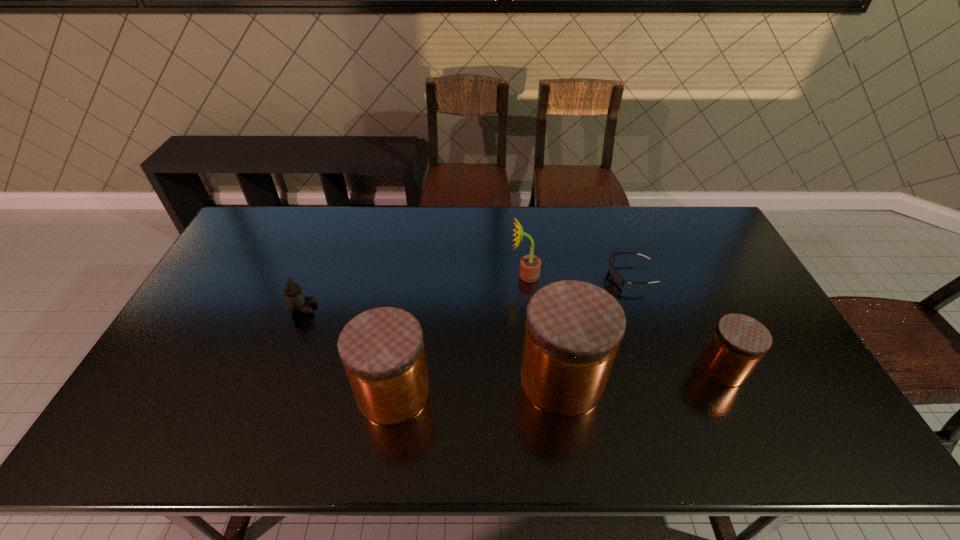
I want to click on object that is positioned at the right edge, so click(x=738, y=342).

The image size is (960, 540). Find the location of `object located in the near right corner section of the desktop`. object located in the near right corner section of the desktop is located at coordinates (738, 342).

Find the location of `vacant area at the far edge of the desktop`. vacant area at the far edge of the desktop is located at coordinates (482, 209).

Where is `vacant space at the left edge of the desktop`? This screenshot has height=540, width=960. vacant space at the left edge of the desktop is located at coordinates (186, 355).

The image size is (960, 540). I want to click on free space at the right edge of the desktop, so click(702, 249).

Find the location of a particular element. The width and height of the screenshot is (960, 540). free space at the far right corner is located at coordinates (687, 241).

In the image, there is a desktop. Identify the location of vacant area at the near right corner. (754, 387).

The image size is (960, 540). Identify the location of vacant point located between the third shortest object and the second jar from left to right. (642, 373).

Where is `unoccupied area between the fourth nearest object and the shortest object`? This screenshot has width=960, height=540. unoccupied area between the fourth nearest object and the shortest object is located at coordinates (467, 292).

This screenshot has width=960, height=540. What are the coordinates of `vacant area between the fourth nearest object and the sunflower` in the screenshot? It's located at (414, 292).